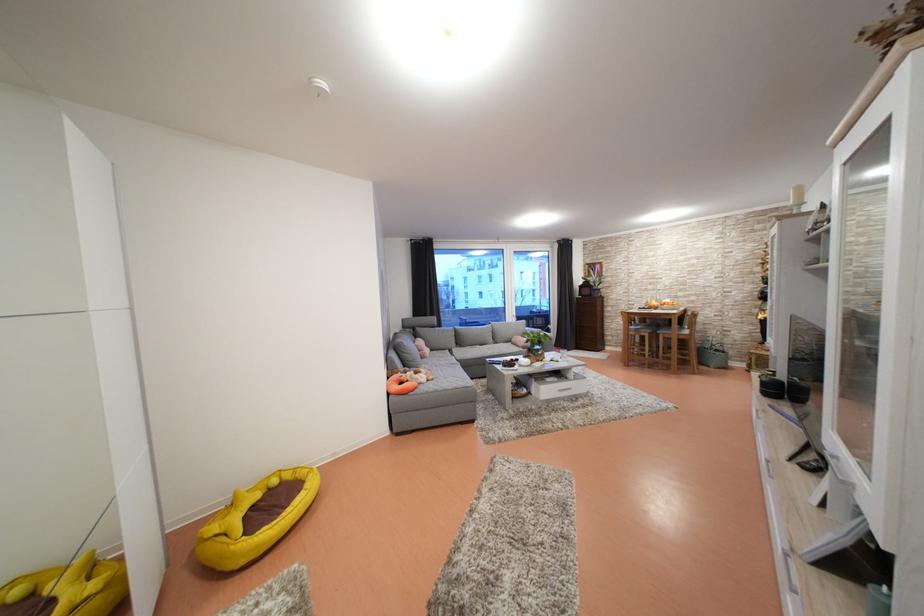
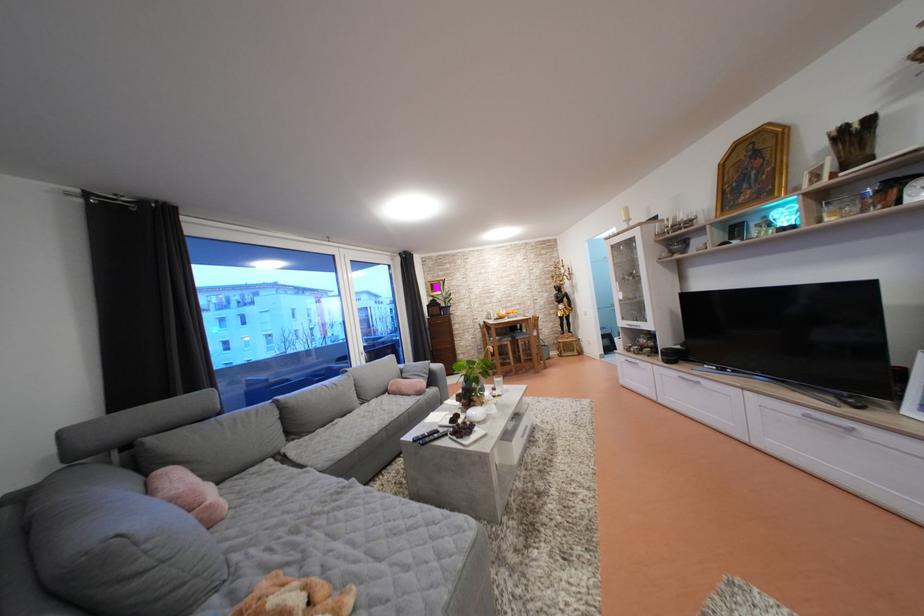
Find the pixel in the second image that matches (x=423, y=351) in the first image.

(180, 505)